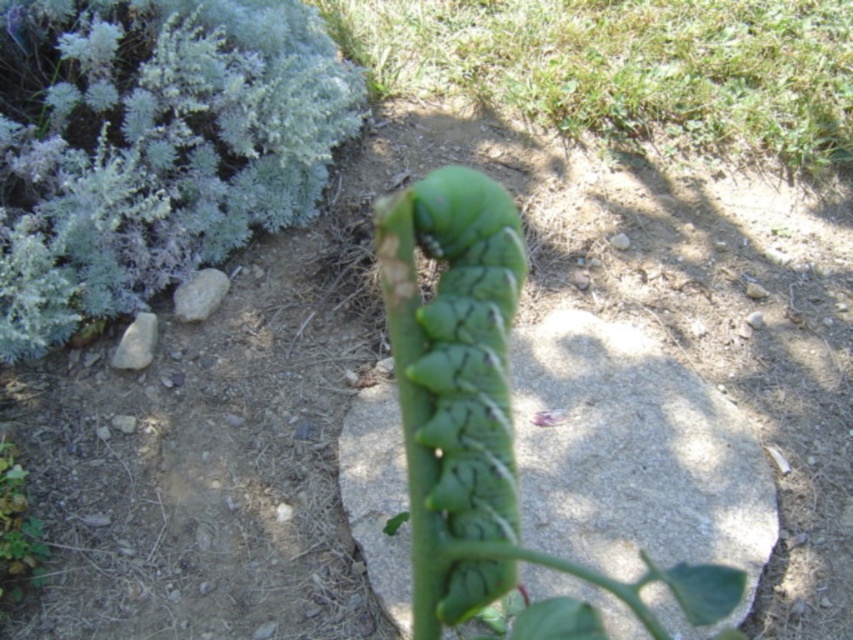
Can you confirm if silvery-green fuzzy bush at upper left is shorter than green matte caterpillar at center?

Correct, silvery-green fuzzy bush at upper left is not as tall as green matte caterpillar at center.

Can you confirm if silvery-green fuzzy bush at upper left is bigger than green matte caterpillar at center?

Yes, silvery-green fuzzy bush at upper left is bigger than green matte caterpillar at center.

Between point (193, 6) and point (476, 224), which one is positioned behind?

The point (193, 6) is more distant.

This screenshot has width=853, height=640. What are the coordinates of `silvery-green fuzzy bush at upper left` in the screenshot? It's located at (154, 147).

You are a GUI agent. You are given a task and a screenshot of the screen. Output one action in this format:
    pyautogui.click(x=<x>, y=<y>)
    Task: Click on the green rough stone at center
    This screenshot has height=640, width=853.
    Given the screenshot: What is the action you would take?
    click(636, 452)

Does green rough stone at center appear on the right side of green matte plant at lower left?

Result: Correct, you'll find green rough stone at center to the right of green matte plant at lower left.

Identify the location of green rough stone at center. (636, 452).

The width and height of the screenshot is (853, 640). Find the location of `green rough stone at center`. green rough stone at center is located at coordinates (636, 452).

I want to click on green matte caterpillar at center, so click(x=454, y=385).

Does green matte caterpillar at center have a lesser height compared to green matte plant at lower left?

In fact, green matte caterpillar at center may be taller than green matte plant at lower left.

Between point (502, 396) and point (12, 588), which one is positioned in front?

Point (502, 396) is more forward.

Where is `green matte caterpillar at center`? The image size is (853, 640). green matte caterpillar at center is located at coordinates (454, 385).